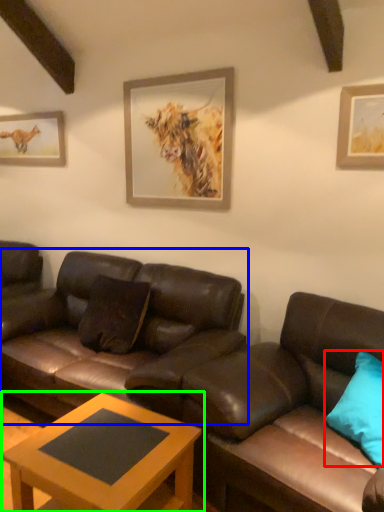
Question: Which is nearer to the pillow (highlighted by a red box)? studio couch (highlighted by a blue box) or coffee table (highlighted by a green box).

Choices:
 (A) studio couch
 (B) coffee table

Answer: (B)